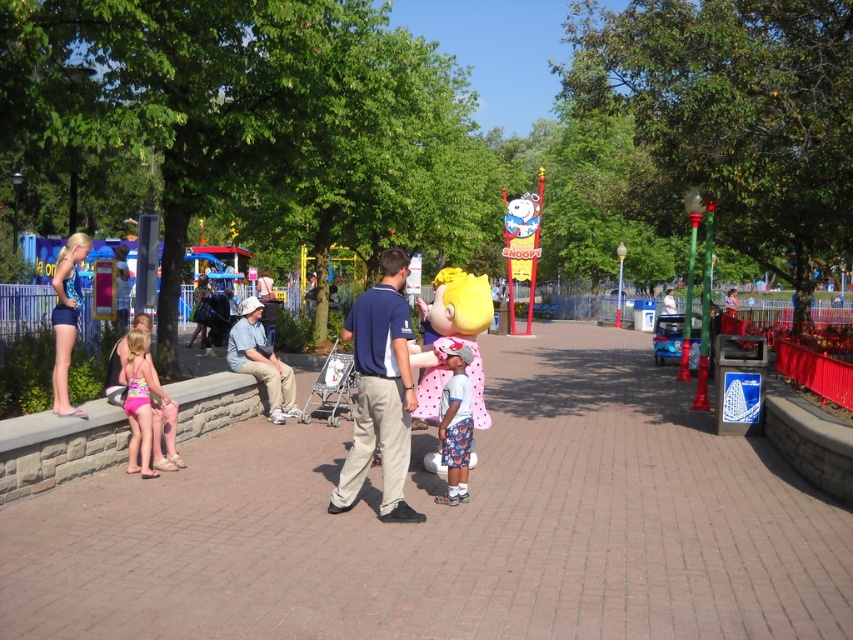
Does pink polka dot dress at center have a larger size compared to pink fabric swimsuit at left?

Incorrect, pink polka dot dress at center is not larger than pink fabric swimsuit at left.

Is the position of pink polka dot dress at center more distant than that of pink fabric swimsuit at left?

No, it is in front of pink fabric swimsuit at left.

Does point (450, 422) come in front of point (148, 365)?

Yes, point (450, 422) is in front of point (148, 365).

You are a GUI agent. You are given a task and a screenshot of the screen. Output one action in this format:
    pyautogui.click(x=<x>, y=<y>)
    Task: Click on the pink polka dot dress at center
    The image size is (853, 640).
    Given the screenshot: What is the action you would take?
    pyautogui.click(x=456, y=420)

Who is positioned more to the right, light blue cotton shirt at center or pink fabric swimsuit at left?

light blue cotton shirt at center is more to the right.

Does light blue cotton shirt at center have a lesser height compared to pink fabric swimsuit at left?

No.

This screenshot has height=640, width=853. Identify the location of light blue cotton shirt at center. (260, 360).

Find the location of a particular element. The image size is (853, 640). light blue cotton shirt at center is located at coordinates (260, 360).

Who is higher up, matte blue shirt at center or light blue cotton shirt at center?

matte blue shirt at center is higher up.

Who is positioned more to the left, matte blue shirt at center or light blue cotton shirt at center?

From the viewer's perspective, light blue cotton shirt at center appears more on the left side.

Identify the location of matte blue shirt at center. Image resolution: width=853 pixels, height=640 pixels. (380, 392).